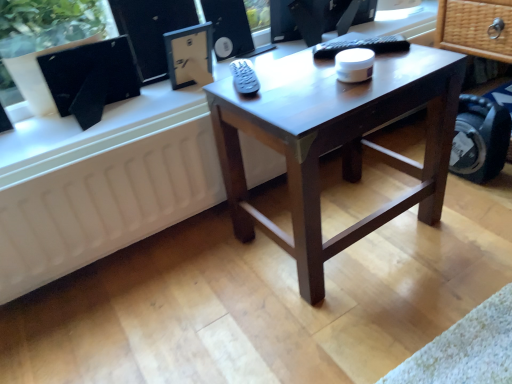
Question: Is matte dark brown coffee table at center smaller than white matte radiator at lower left?

Choices:
 (A) no
 (B) yes

Answer: (A)

Question: Is matte dark brown coffee table at center far away from white matte radiator at lower left?

Choices:
 (A) no
 (B) yes

Answer: (A)

Question: From a real-world perspective, is matte dark brown coffee table at center physically below white matte radiator at lower left?

Choices:
 (A) yes
 (B) no

Answer: (B)

Question: Is matte dark brown coffee table at center outside white matte radiator at lower left?

Choices:
 (A) yes
 (B) no

Answer: (A)

Question: Is matte dark brown coffee table at center shorter than white matte radiator at lower left?

Choices:
 (A) yes
 (B) no

Answer: (B)

Question: Considering the relative sizes of matte dark brown coffee table at center and white matte radiator at lower left in the image provided, is matte dark brown coffee table at center thinner than white matte radiator at lower left?

Choices:
 (A) no
 (B) yes

Answer: (A)

Question: From a real-world perspective, is matte black speaker at upper center located higher than white matte radiator at lower left?

Choices:
 (A) yes
 (B) no

Answer: (A)

Question: Is matte black speaker at upper center in contact with white matte radiator at lower left?

Choices:
 (A) yes
 (B) no

Answer: (B)

Question: Can you confirm if matte black speaker at upper center is positioned to the left of white matte radiator at lower left?

Choices:
 (A) yes
 (B) no

Answer: (B)

Question: Is matte black speaker at upper center turned away from white matte radiator at lower left?

Choices:
 (A) no
 (B) yes

Answer: (A)

Question: Is matte black speaker at upper center located outside white matte radiator at lower left?

Choices:
 (A) yes
 (B) no

Answer: (A)

Question: Can you confirm if matte black speaker at upper center is shorter than white matte radiator at lower left?

Choices:
 (A) no
 (B) yes

Answer: (B)

Question: Is matte dark brown coffee table at center closer to camera compared to black matte computer monitor at upper left?

Choices:
 (A) no
 (B) yes

Answer: (B)